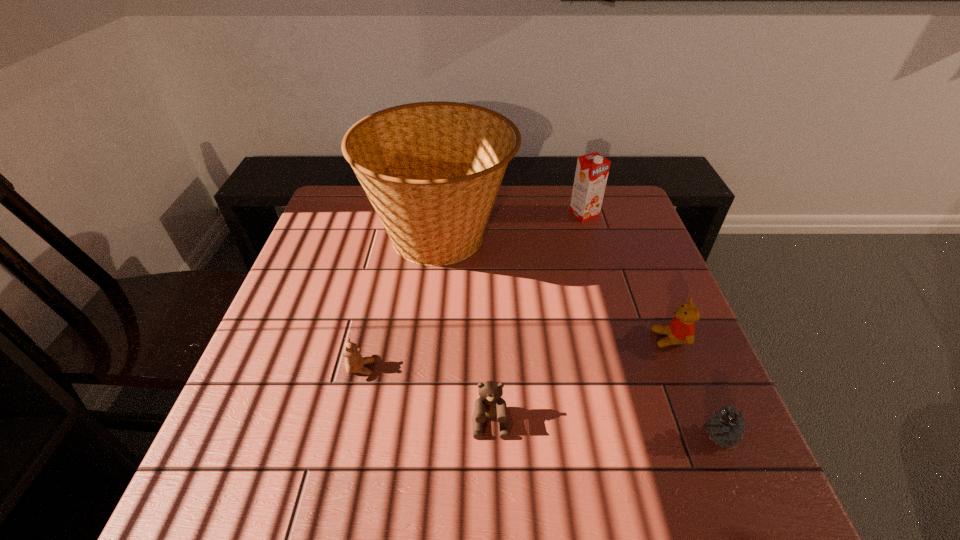
This screenshot has width=960, height=540. I want to click on vacant space at the near right corner of the desktop, so click(x=765, y=491).

Where is `empty space that is in between the pinecone and the rightmost teddy bear`? The height and width of the screenshot is (540, 960). empty space that is in between the pinecone and the rightmost teddy bear is located at coordinates (695, 387).

You are a GUI agent. You are given a task and a screenshot of the screen. Output one action in this format:
    pyautogui.click(x=<x>, y=<y>)
    Task: Click on the vacant space in between the rightmost teddy bear and the carton
    
    Given the screenshot: What is the action you would take?
    pyautogui.click(x=627, y=276)

The width and height of the screenshot is (960, 540). In order to click on free space between the pinecone and the fifth shortest object in this screenshot , I will do `click(652, 325)`.

Where is `free area in between the fourth object from left to right and the leftmost teddy bear`? Image resolution: width=960 pixels, height=540 pixels. free area in between the fourth object from left to right and the leftmost teddy bear is located at coordinates (472, 291).

Locate an element on the screen. The height and width of the screenshot is (540, 960). free spot between the pinecone and the fourth object from left to right is located at coordinates (652, 325).

This screenshot has width=960, height=540. Find the location of `vacant point located between the nearest teddy bear and the tallest object`. vacant point located between the nearest teddy bear and the tallest object is located at coordinates (466, 330).

Locate an element on the screen. The height and width of the screenshot is (540, 960). free space between the pinecone and the shortest teddy bear is located at coordinates (540, 402).

Where is `free space between the nearest teddy bear and the shortest teddy bear`? The image size is (960, 540). free space between the nearest teddy bear and the shortest teddy bear is located at coordinates (426, 396).

Where is `empty space between the rightmost teddy bear and the fifth shortest object`? The height and width of the screenshot is (540, 960). empty space between the rightmost teddy bear and the fifth shortest object is located at coordinates (627, 276).